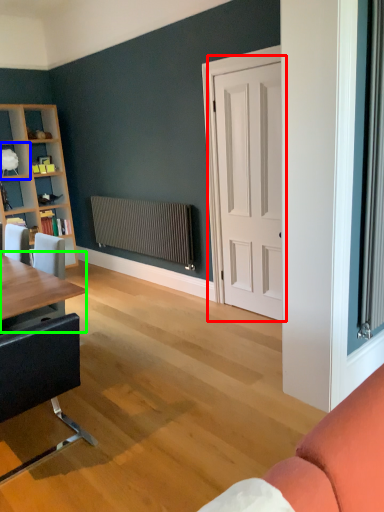
Question: Which object is the closest to the door (highlighted by a red box)? Choose among these: shelf (highlighted by a blue box) or table (highlighted by a green box).

Choices:
 (A) shelf
 (B) table

Answer: (B)